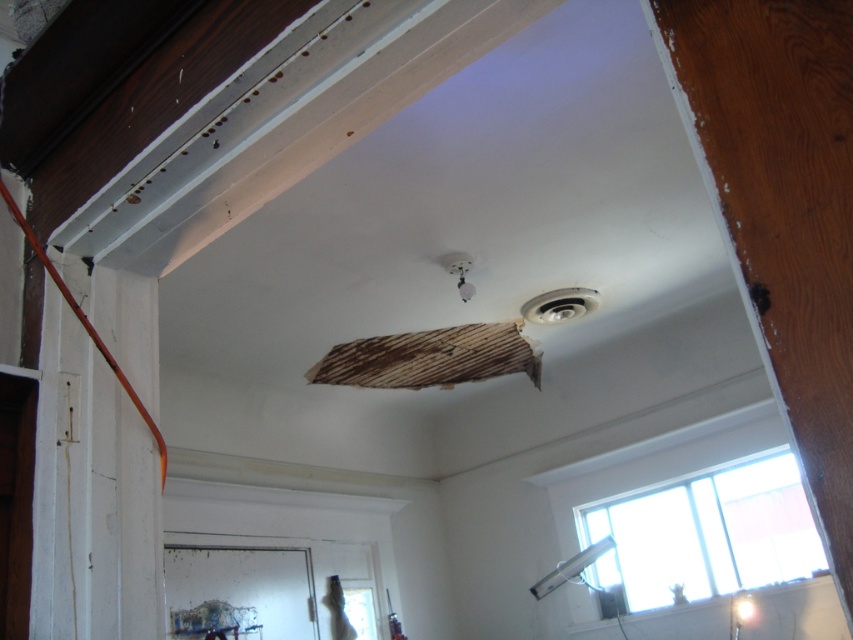
Question: Can you confirm if matte white light fixture at lower right is smaller than white glossy light fixture at upper center?

Choices:
 (A) yes
 (B) no

Answer: (A)

Question: Among these points, which one is farthest from the camera?

Choices:
 (A) (733, 609)
 (B) (469, 285)

Answer: (A)

Question: Which point is farther to the camera?

Choices:
 (A) (457, 256)
 (B) (734, 602)

Answer: (B)

Question: Does matte white light fixture at lower right appear over white glossy light fixture at upper center?

Choices:
 (A) yes
 (B) no

Answer: (B)

Question: Among these objects, which one is nearest to the camera?

Choices:
 (A) matte white light fixture at lower right
 (B) white glossy light fixture at upper center

Answer: (B)

Question: Is matte white light fixture at lower right smaller than white glossy light fixture at upper center?

Choices:
 (A) yes
 (B) no

Answer: (A)